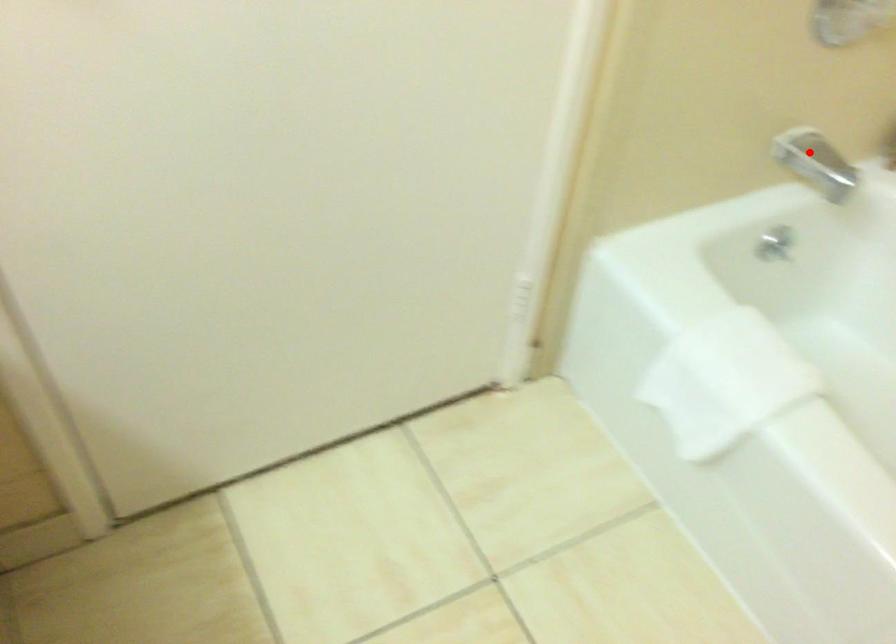
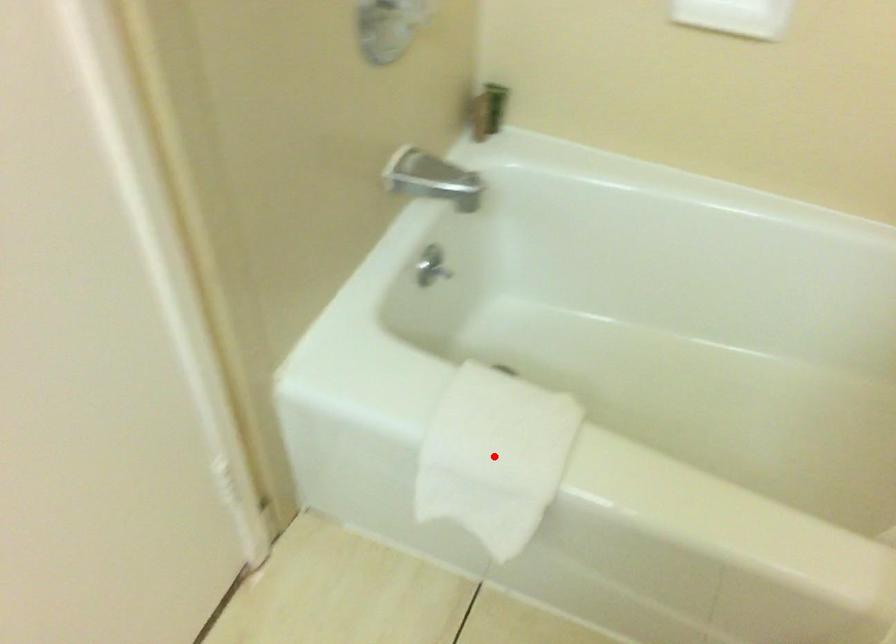
From the picture: I am providing you with two images of the same scene from different viewpoints. A red point is marked on the first image and another point is marked on the second image. Is the marked point in image1 the same physical position as the marked point in image2?

No